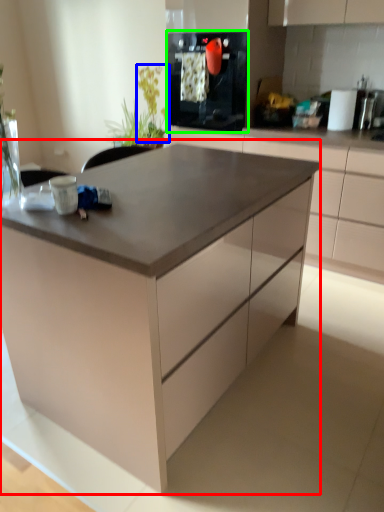
Question: Based on their relative distances, which object is nearer to table (highlighted by a red box)? Choose from plant (highlighted by a blue box) and kitchen appliance (highlighted by a green box).

Choices:
 (A) plant
 (B) kitchen appliance

Answer: (B)